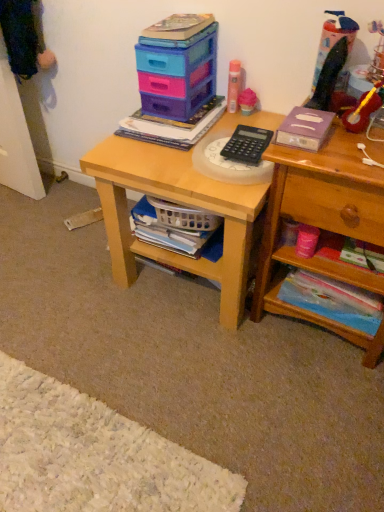
You are a GUI agent. You are given a task and a screenshot of the screen. Output one action in this format:
    pyautogui.click(x=<x>, y=<y>)
    Task: Click on the free space to the left of light wood desk at center
    The image size is (384, 512).
    Given the screenshot: What is the action you would take?
    pyautogui.click(x=59, y=267)